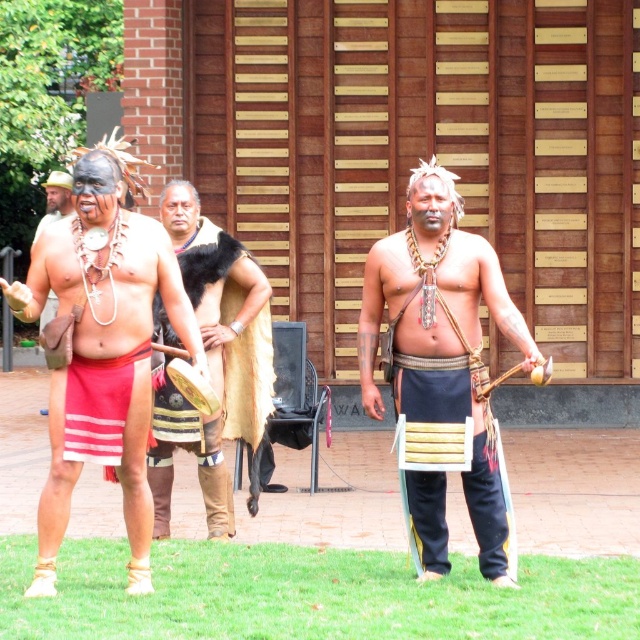
Is matte black headdress at left taller than wooden planks at center?

Correct, matte black headdress at left is much taller as wooden planks at center.

Does matte black headdress at left come in front of wooden planks at center?

Yes.

Image resolution: width=640 pixels, height=640 pixels. Describe the element at coordinates (102, 348) in the screenshot. I see `matte black headdress at left` at that location.

The image size is (640, 640). In order to click on matte black headdress at left in this screenshot , I will do `click(102, 348)`.

Which is more to the right, matte black loincloth at center or matte black headdress at left?

matte black loincloth at center is more to the right.

Is matte black loincloth at center to the right of matte black headdress at left from the viewer's perspective?

Indeed, matte black loincloth at center is positioned on the right side of matte black headdress at left.

Which is in front, point (433, 554) or point (140, 508)?

Point (140, 508)

Where is `matte black loincloth at center`? The width and height of the screenshot is (640, 640). matte black loincloth at center is located at coordinates (442, 371).

Looking at this image, does matte black loincloth at center have a larger size compared to red striped cloth at center?

Yes.

Is matte black loincloth at center in front of red striped cloth at center?

Yes.

Who is more forward, (451, 438) or (68, 388)?

Point (68, 388) is more forward.

This screenshot has width=640, height=640. I want to click on matte black loincloth at center, so click(x=442, y=371).